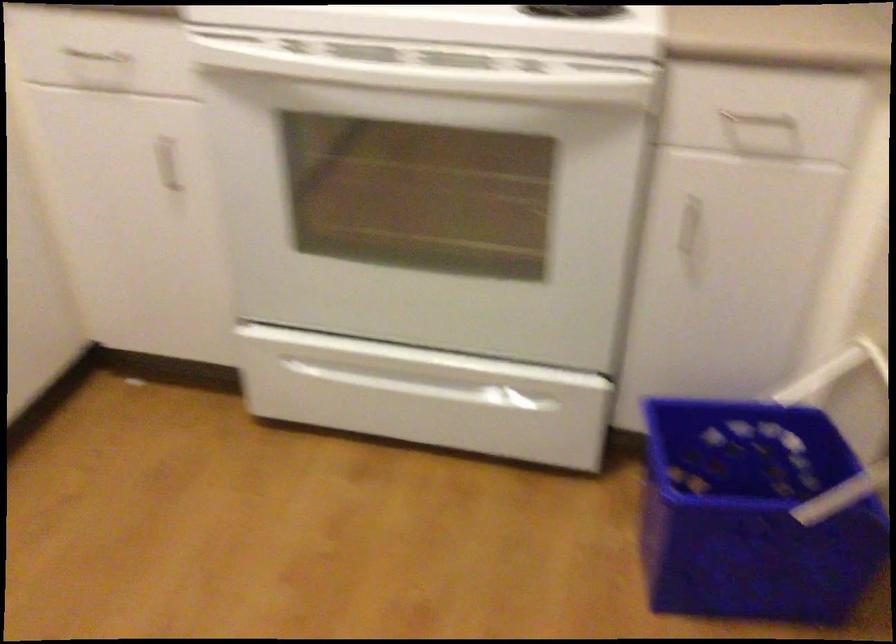
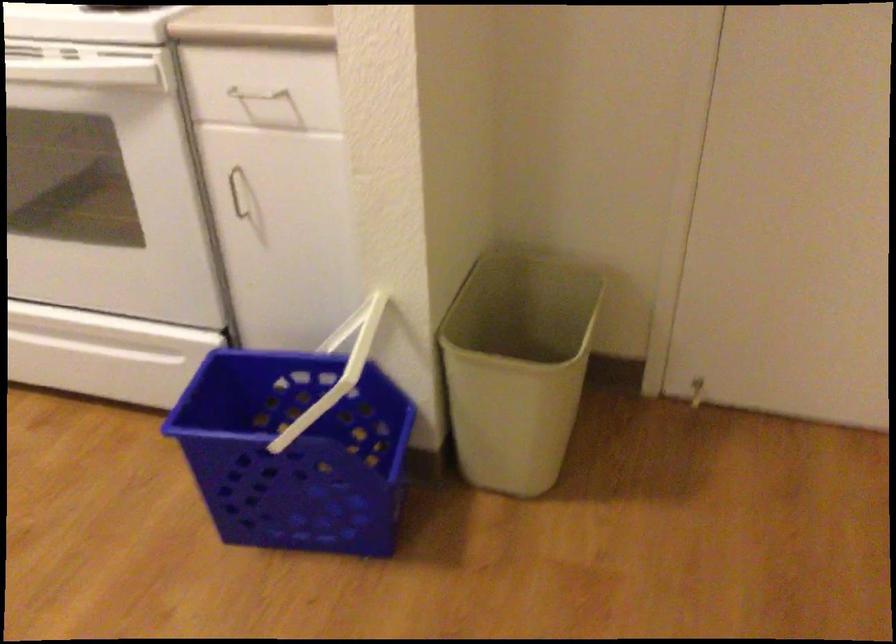
In the second image, find the point that corresponds to pixel 738 115 in the first image.

(253, 98)